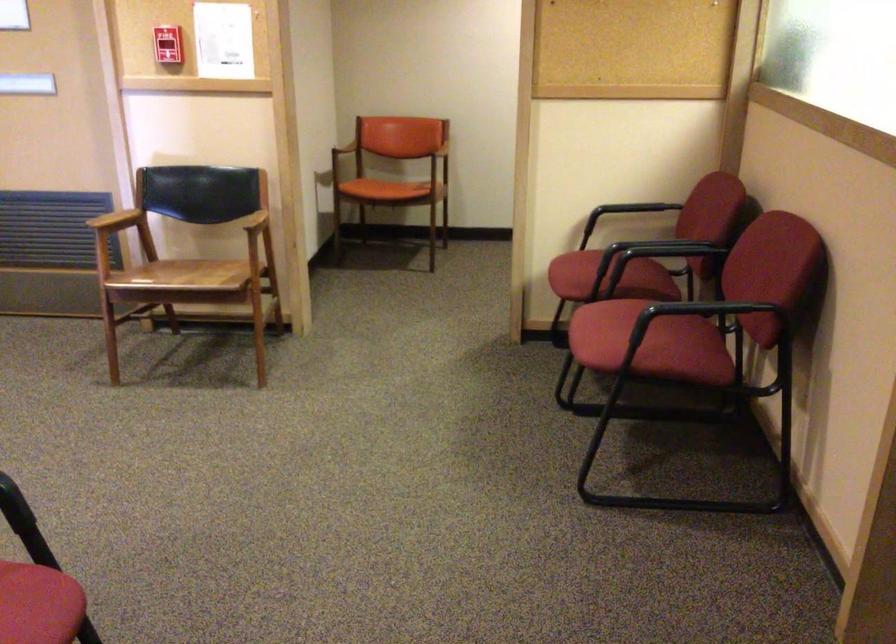
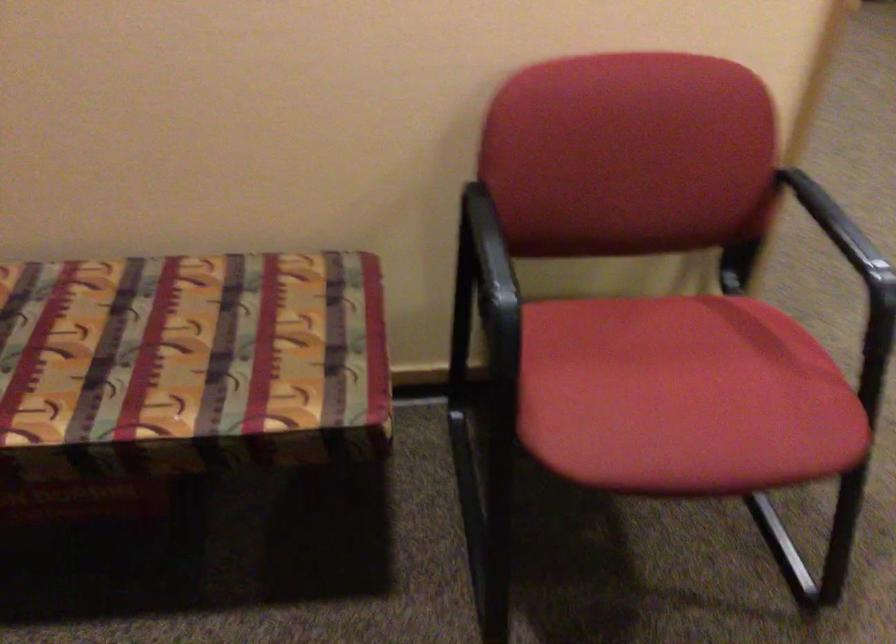
The first image is from the beginning of the video and the second image is from the end. How did the camera likely rotate when shooting the video?

The camera rotated toward left-down.